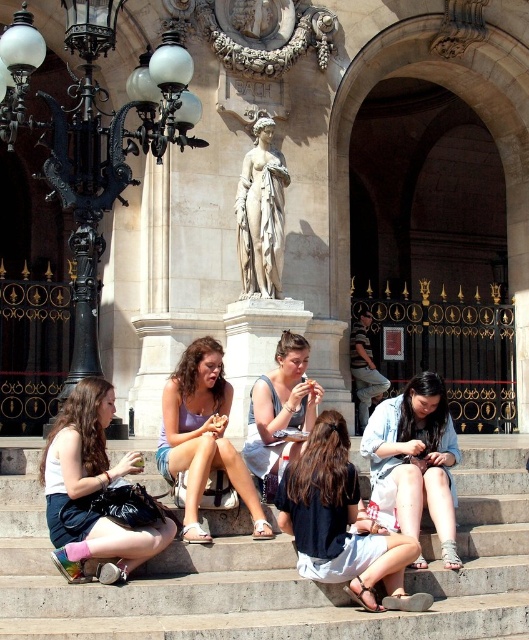
You are standing in the public square and want to take a photo of the light gray concrete stairs at center without the white marble statue at center blocking the view. Is there a way to do this?

The light gray concrete stairs at center are positioned under the white marble statue at center, so if you crouch down or move to a lower angle, you can capture the stairs without the statue obstructing the view.

In the scene described, there are two items of clothing visible. The matte white tank top at lower left and the light blue denim shorts at center. From the perspective of someone standing at the bottom of the steps, which clothing item is positioned to the left?

The matte white tank top at lower left is positioned to the left of the light blue denim shorts at center.

You are a photographer trying to capture a group photo of the light blue denim shirt at center and the light purple fabric dress at center. Since you want both subjects to appear equally tall in the photo, which one should you move closer to the camera?

You should move closer to the light blue denim shirt at center because it has a lesser height compared to the light purple fabric dress at center, so bringing it closer will make them appear more balanced in size in the photo.